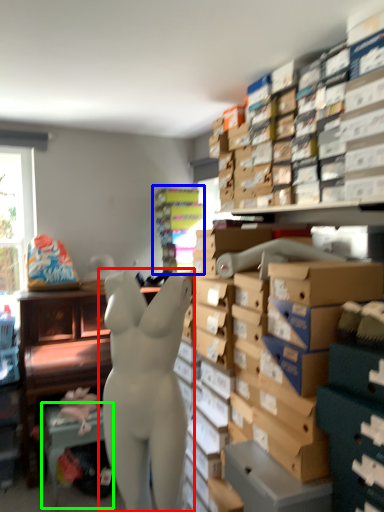
Question: Which object is the closest to the person (highlighted by a red box)? Choose among these: shelf (highlighted by a blue box) or table (highlighted by a green box).

Choices:
 (A) shelf
 (B) table

Answer: (B)